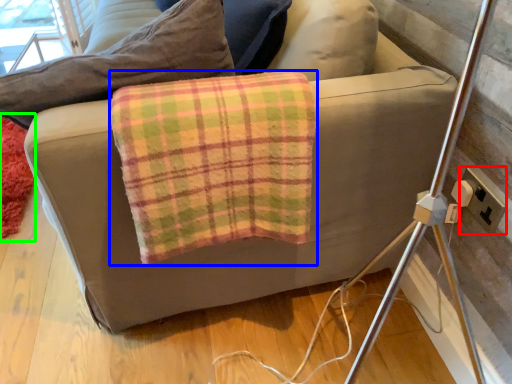
Question: Based on their relative distances, which object is farther from electric outlet (highlighted by a red box)? Choose from material (highlighted by a blue box) and mat (highlighted by a green box).

Choices:
 (A) material
 (B) mat

Answer: (B)